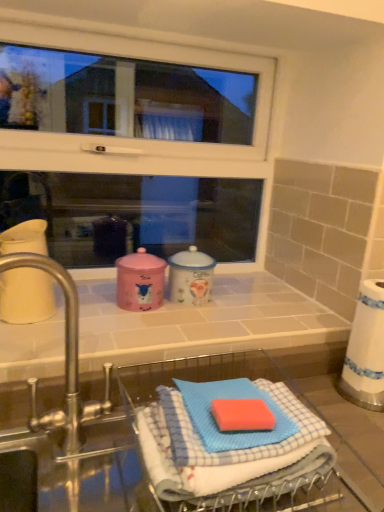
Question: Considering the positions of silver metallic tap at left and blue checkered cloth at lower center in the image, is silver metallic tap at left wider or thinner than blue checkered cloth at lower center?

Choices:
 (A) thin
 (B) wide

Answer: (A)

Question: In the image, is silver metallic tap at left positioned in front of or behind blue checkered cloth at lower center?

Choices:
 (A) front
 (B) behind

Answer: (A)

Question: Estimate the real-world distances between objects in this image. Which object is closer to the blue checkered cloth at lower center?

Choices:
 (A) white glossy counter top at center
 (B) silver metallic tap at left
 (C) white glossy window at upper center

Answer: (B)

Question: Considering the real-world distances, which object is farthest from the white glossy window at upper center?

Choices:
 (A) white glossy counter top at center
 (B) blue checkered cloth at lower center
 (C) silver metallic tap at left

Answer: (B)